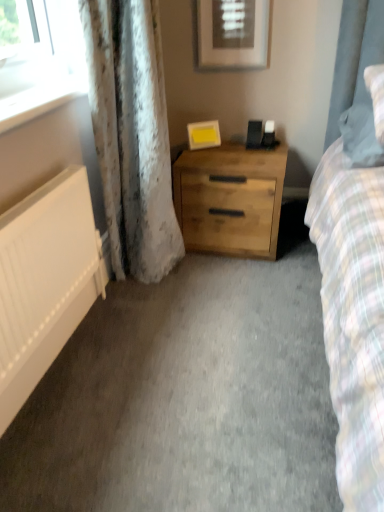
Question: Looking at their shapes, would you say matte white picture frame at upper center, which appears as the 1th picture frame when viewed from the top, is wider or thinner than white textured curtain at left?

Choices:
 (A) thin
 (B) wide

Answer: (A)

Question: Considering the positions of point (246, 12) and point (89, 17), is point (246, 12) closer or farther from the camera than point (89, 17)?

Choices:
 (A) farther
 (B) closer

Answer: (A)

Question: Which object is the farthest from the natural wood chest of drawers at center?

Choices:
 (A) white matte radiator at left
 (B) fluffy white pillow at right
 (C) matte white picture frame at upper center, which appears as the 1th picture frame when viewed from the top
 (D) white glossy window sill at upper left
 (E) yellow matte picture frame at center, which is counted as the 2th picture frame, starting from the top

Answer: (D)

Question: Considering the real-world distances, which object is closest to the matte white picture frame at upper center, which appears as the 1th picture frame when viewed from the top?

Choices:
 (A) yellow matte picture frame at center, which is the 1th picture frame in bottom-to-top order
 (B) fluffy white pillow at right
 (C) white glossy window sill at upper left
 (D) natural wood chest of drawers at center
 (E) white matte radiator at left

Answer: (A)